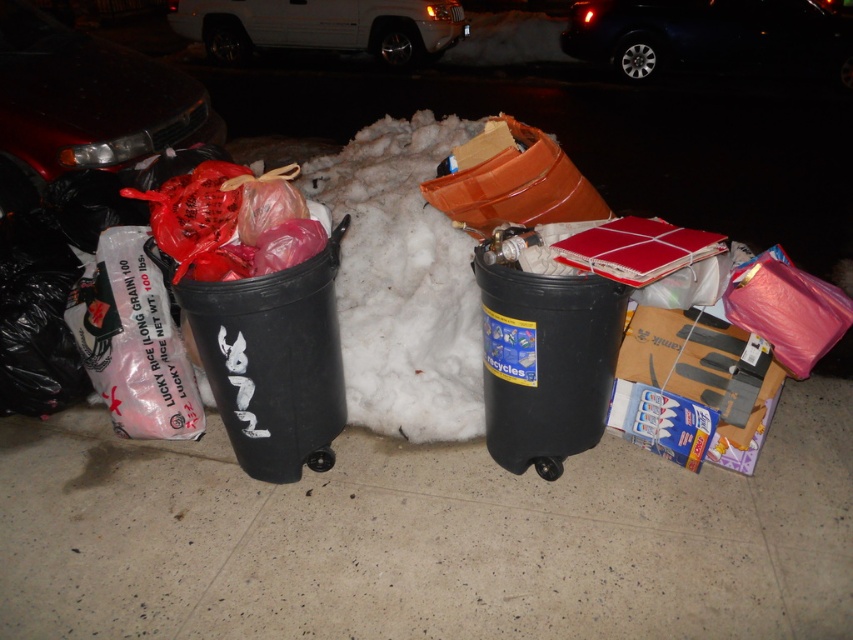
Is shiny red car at left shorter than white matte van at upper center?

Incorrect, shiny red car at left's height does not fall short of white matte van at upper center's.

Can you confirm if shiny red car at left is positioned to the left of white matte van at upper center?

Correct, you'll find shiny red car at left to the left of white matte van at upper center.

Does point (28, 54) lie in front of point (202, 4)?

Yes, it is in front of point (202, 4).

The width and height of the screenshot is (853, 640). Identify the location of shiny red car at left. (84, 104).

Is black plastic recycling bin at lower right shorter than shiny black car at upper right?

Yes, black plastic recycling bin at lower right is shorter than shiny black car at upper right.

Which is more to the right, black plastic recycling bin at lower right or shiny black car at upper right?

shiny black car at upper right

Who is more forward, (543, 337) or (576, 22)?

Positioned in front is point (543, 337).

Find the location of a particular element. black plastic recycling bin at lower right is located at coordinates 544,356.

You are a GUI agent. You are given a task and a screenshot of the screen. Output one action in this format:
    pyautogui.click(x=<x>, y=<y>)
    Task: Click on the black plastic recycling bin at lower right
    
    Given the screenshot: What is the action you would take?
    click(544, 356)

Does point (543, 307) come farther from viewer compared to point (241, 28)?

No, it is in front of (241, 28).

Which is in front, point (608, 369) or point (404, 4)?

Point (608, 369) is in front.

Identify the location of black plastic recycling bin at lower right. (544, 356).